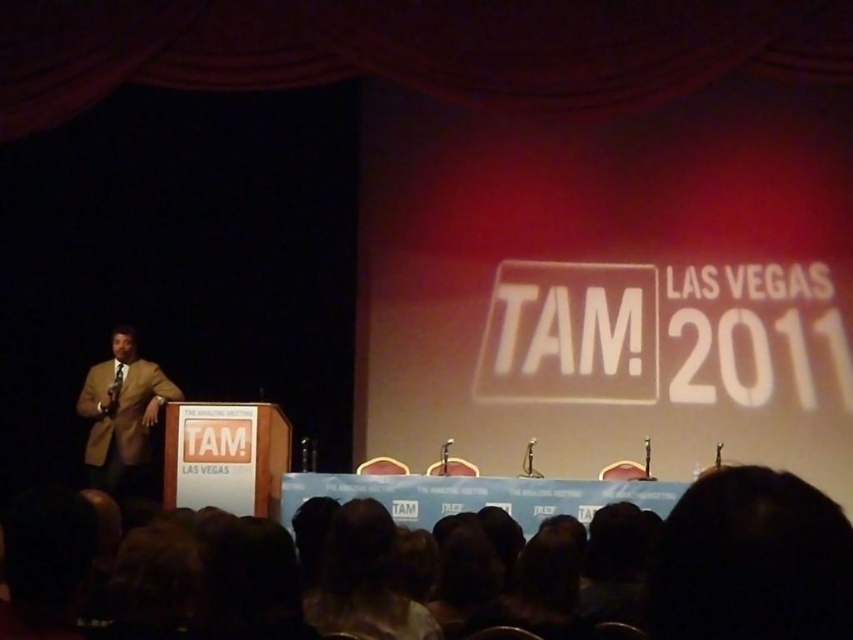
Question: Which point appears closest to the camera in this image?

Choices:
 (A) 669,522
 (B) 109,436

Answer: (A)

Question: Is dark hair at lower right below light brown suit at left?

Choices:
 (A) yes
 (B) no

Answer: (B)

Question: Can you confirm if dark hair at lower right is bigger than light brown suit at left?

Choices:
 (A) yes
 (B) no

Answer: (B)

Question: Which point appears farthest from the camera in this image?

Choices:
 (A) (714, 573)
 (B) (125, 397)

Answer: (B)

Question: Does dark hair at lower right have a greater width compared to light brown suit at left?

Choices:
 (A) no
 (B) yes

Answer: (A)